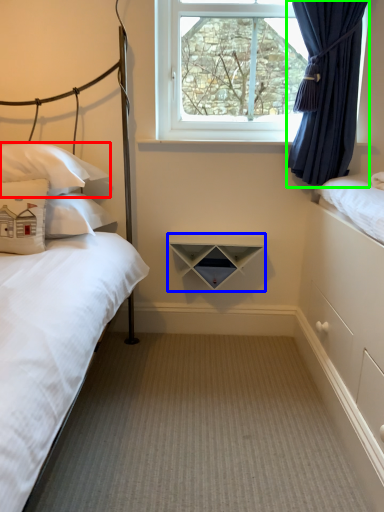
Question: Estimate the real-world distances between objects in this image. Which object is closer to pillow (highlighted by a red box), shelf (highlighted by a blue box) or curtain (highlighted by a green box)?

Choices:
 (A) shelf
 (B) curtain

Answer: (A)